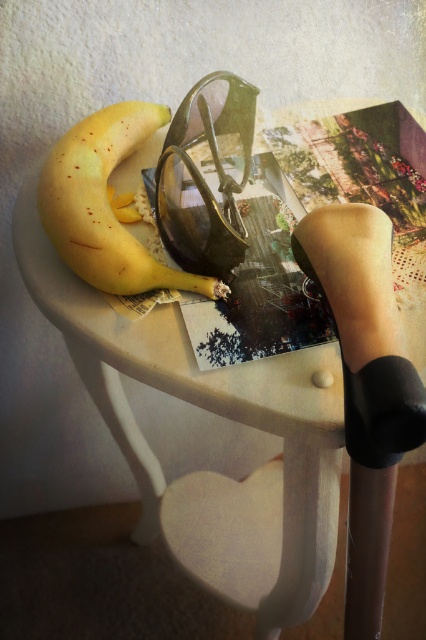
Question: Is yellow matte banana at left positioned before shiny black goggles at center?

Choices:
 (A) no
 (B) yes

Answer: (A)

Question: Which object is farther from the camera taking this photo?

Choices:
 (A) shiny black goggles at center
 (B) yellow matte banana at left

Answer: (B)

Question: Does yellow matte banana at left have a larger size compared to shiny black goggles at center?

Choices:
 (A) yes
 (B) no

Answer: (A)

Question: Is yellow matte banana at left below shiny black goggles at center?

Choices:
 (A) yes
 (B) no

Answer: (A)